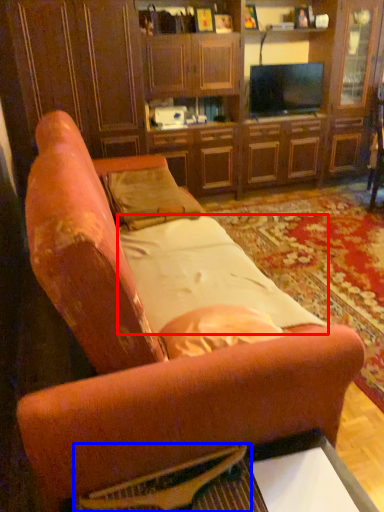
Question: Which object is further to the camera taking this photo, sheet (highlighted by a red box) or flat (highlighted by a blue box)?

Choices:
 (A) sheet
 (B) flat

Answer: (A)